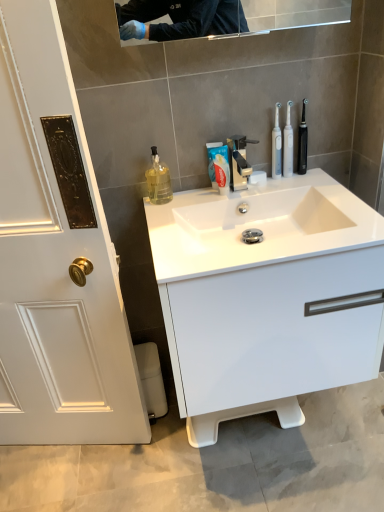
In order to face white glossy sink at center, should I rotate leftwards or rightwards?

To align with it, rotate right about 8.320°.

Where is `white glossy sink at center`? white glossy sink at center is located at coordinates tap(258, 226).

Measure the distance between point [278,104] and camera.

Point [278,104] and camera are 1.32 meters apart from each other.

The width and height of the screenshot is (384, 512). Describe the element at coordinates (266, 297) in the screenshot. I see `white glossy cabinet at center` at that location.

At what (x,y) coordinates should I click in order to perform the action: click on white glossy cabinet at center. Please return your answer as a coordinate pair (x, y). This screenshot has width=384, height=512. Looking at the image, I should click on (266, 297).

The height and width of the screenshot is (512, 384). In order to click on translucent glass mouthwash at left, the 1th mouthwash positioned from the left in this screenshot , I will do `click(158, 180)`.

Measure the distance between polished chrome faucet at center and camera.

The distance of polished chrome faucet at center from camera is 4.25 feet.

Where is `black plastic toothbrush at right, the 2th toothbrush positioned from the left`? This screenshot has height=512, width=384. black plastic toothbrush at right, the 2th toothbrush positioned from the left is located at coordinates (302, 141).

Find the location of a particular element. white plastic toothbrush at upper right, which appears as the first toothbrush when viewed from the left is located at coordinates (288, 144).

Is translucent glass mouthwash at left, the 1th mouthwash positioned from the left, at the right side of white glossy sink at center?

Incorrect, translucent glass mouthwash at left, the 1th mouthwash positioned from the left, is not on the right side of white glossy sink at center.

Considering the positions of objects translucent glass mouthwash at left, the 1th mouthwash positioned from the left, and white glossy sink at center in the image provided, who is behind, translucent glass mouthwash at left, the 1th mouthwash positioned from the left, or white glossy sink at center?

translucent glass mouthwash at left, the 1th mouthwash positioned from the left, is behind.

Does translucent glass mouthwash at left, which is the second mouthwash in right-to-left order, have a smaller size compared to white glossy sink at center?

Yes.

Which object is wider, translucent glass mouthwash at left, the 1th mouthwash positioned from the left, or white glossy sink at center?

Wider between the two is white glossy sink at center.

Is translucent plastic mouthwash at center, which is the 2th mouthwash from left to right, facing towards white glossy toothpaste at center?

No.

Which of these two, translucent plastic mouthwash at center, which is the 2th mouthwash from left to right, or white glossy toothpaste at center, is bigger?

white glossy toothpaste at center.

From a real-world perspective, is translucent plastic mouthwash at center, which is the 2th mouthwash from left to right, located beneath white glossy toothpaste at center?

Actually, translucent plastic mouthwash at center, which is the 2th mouthwash from left to right, is physically above white glossy toothpaste at center in the real world.

Visually, is translucent plastic mouthwash at center, the 1th mouthwash when ordered from right to left, positioned to the left or to the right of white glossy toothpaste at center?

From the image, it's evident that translucent plastic mouthwash at center, the 1th mouthwash when ordered from right to left, is to the right of white glossy toothpaste at center.

Is white glossy cabinet at center taller or shorter than translucent plastic mouthwash at center, which is the 2th mouthwash from left to right?

In the image, white glossy cabinet at center appears to be taller than translucent plastic mouthwash at center, which is the 2th mouthwash from left to right.

Does point (171, 319) lie in front of point (275, 165)?

Yes.

Considering the sizes of objects white glossy cabinet at center and translucent plastic mouthwash at center, the 1th mouthwash when ordered from right to left, in the image provided, who is bigger, white glossy cabinet at center or translucent plastic mouthwash at center, the 1th mouthwash when ordered from right to left,?

With larger size is white glossy cabinet at center.

Is translucent plastic mouthwash at center, the 1th mouthwash when ordered from right to left, with translucent glass mouthwash at left, the 1th mouthwash positioned from the left?

They are not placed beside each other.

From the image's perspective, which is below, translucent plastic mouthwash at center, which is the 2th mouthwash from left to right, or translucent glass mouthwash at left, the 1th mouthwash positioned from the left?

translucent glass mouthwash at left, the 1th mouthwash positioned from the left, appears lower in the image.

I want to click on mouthwash above the translucent glass mouthwash at left, which is the second mouthwash in right-to-left order (from the image's perspective), so click(276, 145).

Which of these two, translucent plastic mouthwash at center, the 1th mouthwash when ordered from right to left, or translucent glass mouthwash at left, which is the second mouthwash in right-to-left order, is smaller?

Smaller between the two is translucent plastic mouthwash at center, the 1th mouthwash when ordered from right to left.

Can you confirm if white glossy cabinet at center is smaller than white plastic toothbrush at upper right, placed as the second toothbrush when sorted from right to left?

Actually, white glossy cabinet at center might be larger than white plastic toothbrush at upper right, placed as the second toothbrush when sorted from right to left.

Does point (218, 397) come closer to viewer compared to point (290, 172)?

Yes, point (218, 397) is in front of point (290, 172).

From the image's perspective, is white glossy cabinet at center located beneath white plastic toothbrush at upper right, which appears as the first toothbrush when viewed from the left?

Yes.

From the picture: Is white glossy cabinet at center taller or shorter than white plastic toothbrush at upper right, which appears as the first toothbrush when viewed from the left?

Clearly, white glossy cabinet at center is taller compared to white plastic toothbrush at upper right, which appears as the first toothbrush when viewed from the left.

Considering the relative sizes of white glossy sink at center and translucent glass mouthwash at left, which is the second mouthwash in right-to-left order, in the image provided, is white glossy sink at center taller than translucent glass mouthwash at left, which is the second mouthwash in right-to-left order,?

Incorrect, the height of white glossy sink at center is not larger of that of translucent glass mouthwash at left, which is the second mouthwash in right-to-left order.

From the image's perspective, which one is positioned lower, white glossy sink at center or translucent glass mouthwash at left, which is the second mouthwash in right-to-left order?

white glossy sink at center appears lower in the image.

Can you confirm if white glossy sink at center is positioned to the right of translucent glass mouthwash at left, which is the second mouthwash in right-to-left order?

Yes, white glossy sink at center is to the right of translucent glass mouthwash at left, which is the second mouthwash in right-to-left order.

Considering the positions of objects white glossy sink at center and translucent glass mouthwash at left, which is the second mouthwash in right-to-left order, in the image provided, who is in front, white glossy sink at center or translucent glass mouthwash at left, which is the second mouthwash in right-to-left order,?

white glossy sink at center is more forward.

Relative to translucent plastic mouthwash at center, which is the 2th mouthwash from left to right, is white glossy sink at center in front or behind?

Visually, white glossy sink at center is located in front of translucent plastic mouthwash at center, which is the 2th mouthwash from left to right.

Which is correct: white glossy sink at center is inside translucent plastic mouthwash at center, which is the 2th mouthwash from left to right, or outside of it?

white glossy sink at center is not inside translucent plastic mouthwash at center, which is the 2th mouthwash from left to right, it's outside.

From the image's perspective, is white glossy sink at center positioned above or below translucent plastic mouthwash at center, which is the 2th mouthwash from left to right?

From the image's perspective, white glossy sink at center appears below translucent plastic mouthwash at center, which is the 2th mouthwash from left to right.

Locate an element on the screen. The height and width of the screenshot is (512, 384). sink lying on the right of translucent glass mouthwash at left, the 1th mouthwash positioned from the left is located at coordinates (258, 226).

I want to click on mouthwash above the white glossy toothpaste at center (from the image's perspective), so click(276, 145).

From the image, which object appears to be nearer to white glossy sink at center, white plastic toothbrush at upper right, placed as the second toothbrush when sorted from right to left, or black plastic toothbrush at right, which appears as the 1th toothbrush when viewed from the right?

Among the two, white plastic toothbrush at upper right, placed as the second toothbrush when sorted from right to left, is located nearer to white glossy sink at center.

Which object lies further to the anchor point translucent plastic mouthwash at center, the 1th mouthwash when ordered from right to left, polished chrome faucet at center or white glossy sink at center?

white glossy sink at center is further to translucent plastic mouthwash at center, the 1th mouthwash when ordered from right to left.

Which object lies nearer to the anchor point polished chrome faucet at center, white plastic toothbrush at upper right, which appears as the first toothbrush when viewed from the left, or white glossy toothpaste at center?

white glossy toothpaste at center is positioned closer to the anchor polished chrome faucet at center.

Looking at the image, which one is located closer to black plastic toothbrush at right, which appears as the 1th toothbrush when viewed from the right, white glossy toothpaste at center or translucent plastic mouthwash at center, the 1th mouthwash when ordered from right to left?

translucent plastic mouthwash at center, the 1th mouthwash when ordered from right to left.

From the image, which object appears to be nearer to translucent glass mouthwash at left, the 1th mouthwash positioned from the left, black plastic toothbrush at right, the 2th toothbrush positioned from the left, or translucent plastic mouthwash at center, the 1th mouthwash when ordered from right to left?

translucent plastic mouthwash at center, the 1th mouthwash when ordered from right to left, is closer to translucent glass mouthwash at left, the 1th mouthwash positioned from the left.

From the image, which object appears to be nearer to white glossy sink at center, translucent plastic mouthwash at center, which is the 2th mouthwash from left to right, or black plastic toothbrush at right, which appears as the 1th toothbrush when viewed from the right?

translucent plastic mouthwash at center, which is the 2th mouthwash from left to right, lies closer to white glossy sink at center than the other object.

Which object lies nearer to the anchor point white glossy cabinet at center, black plastic toothbrush at right, the 2th toothbrush positioned from the left, or translucent plastic mouthwash at center, which is the 2th mouthwash from left to right?

translucent plastic mouthwash at center, which is the 2th mouthwash from left to right, is positioned closer to the anchor white glossy cabinet at center.

When comparing their distances from white glossy cabinet at center, does polished chrome faucet at center or white glossy sink at center seem closer?

Among the two, white glossy sink at center is located nearer to white glossy cabinet at center.

The width and height of the screenshot is (384, 512). I want to click on faucet between white plastic toothbrush at upper right, placed as the second toothbrush when sorted from right to left, and white glossy cabinet at center in the up-down direction, so click(239, 161).

Where is `sink situated between translucent glass mouthwash at left, the 1th mouthwash positioned from the left, and white plastic toothbrush at upper right, which appears as the first toothbrush when viewed from the left, from left to right`? The image size is (384, 512). sink situated between translucent glass mouthwash at left, the 1th mouthwash positioned from the left, and white plastic toothbrush at upper right, which appears as the first toothbrush when viewed from the left, from left to right is located at coordinates (258, 226).

Identify the location of sink between black plastic toothbrush at right, which appears as the 1th toothbrush when viewed from the right, and white glossy cabinet at center from top to bottom. This screenshot has width=384, height=512. (258, 226).

Where is `mouthwash that lies between translucent plastic mouthwash at center, which is the 2th mouthwash from left to right, and white glossy cabinet at center from top to bottom`? mouthwash that lies between translucent plastic mouthwash at center, which is the 2th mouthwash from left to right, and white glossy cabinet at center from top to bottom is located at coordinates point(158,180).